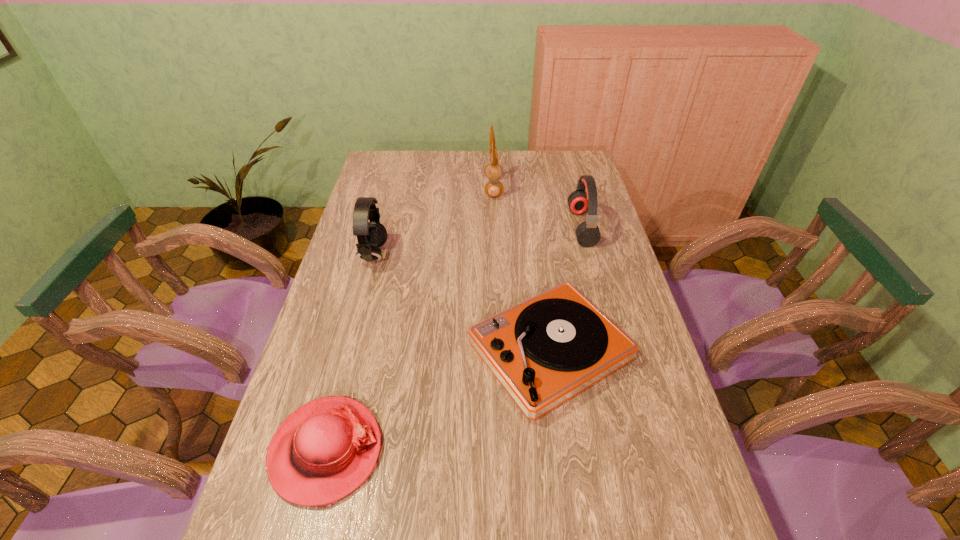
At what (x,y) coordinates should I click in order to perform the action: click on object that stands as the fourth closest to the farthest object. Please return your answer as a coordinate pair (x, y). Looking at the image, I should click on (323, 451).

This screenshot has height=540, width=960. Identify the location of earphone that is the second nearest to the farthest earphone. (371, 235).

Find the location of a particular element. The height and width of the screenshot is (540, 960). the closest earphone to the record player is located at coordinates 588,234.

Where is `vacant area that satisfies the following two spatial constraints: 1. on the ear cups of the record player; 2. on the left side of the leftmost earphone`? The width and height of the screenshot is (960, 540). vacant area that satisfies the following two spatial constraints: 1. on the ear cups of the record player; 2. on the left side of the leftmost earphone is located at coordinates (349, 351).

What are the coordinates of `free space that satisfies the following two spatial constraints: 1. on the ear cups of the leftmost earphone; 2. on the right side of the record player` in the screenshot? It's located at (349, 351).

Where is `vacant region that satisfies the following two spatial constraints: 1. on the front-facing side of the farthest object; 2. on the left side of the record player`? The width and height of the screenshot is (960, 540). vacant region that satisfies the following two spatial constraints: 1. on the front-facing side of the farthest object; 2. on the left side of the record player is located at coordinates (500, 351).